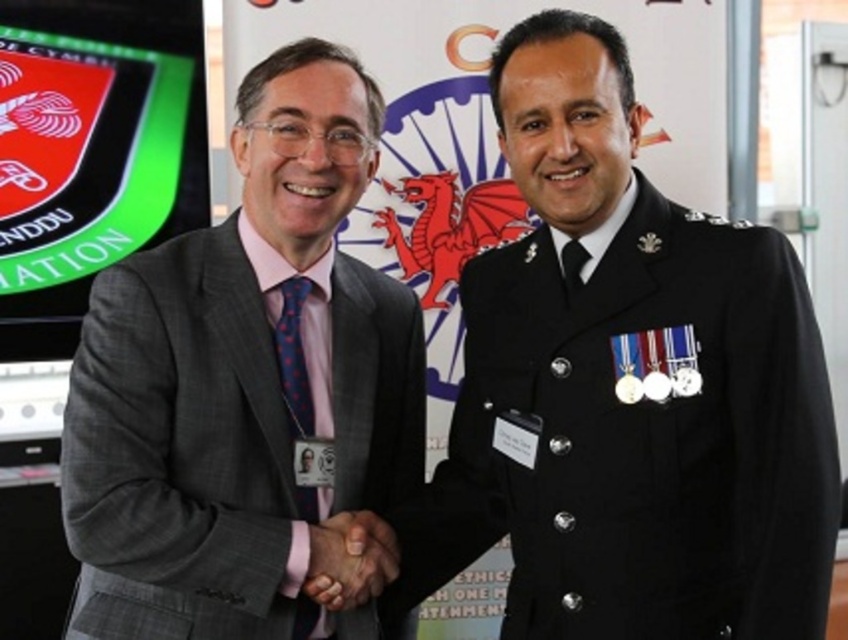
Question: Among these points, which one is nearest to the camera?

Choices:
 (A) (366, 561)
 (B) (302, 381)
 (C) (593, 324)

Answer: (C)

Question: Is black uniform at center wider than matte black hands at center?

Choices:
 (A) no
 (B) yes

Answer: (B)

Question: Does black uniform at center have a larger size compared to blue dotted tie at center?

Choices:
 (A) no
 (B) yes

Answer: (B)

Question: Where is matte gray suit at center located in relation to black satin tie at right in the image?

Choices:
 (A) above
 (B) below

Answer: (B)

Question: Which point is farther from the camera taking this photo?

Choices:
 (A) (567, 262)
 (B) (319, 554)

Answer: (A)

Question: Among these points, which one is farthest from the camera?

Choices:
 (A) (333, 602)
 (B) (564, 275)
 (C) (296, 413)

Answer: (C)